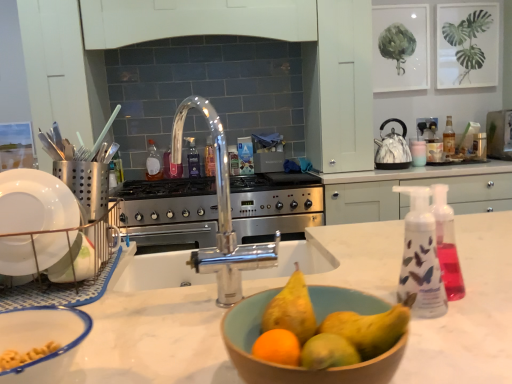
Question: Considering the positions of marble-patterned kettle at right, placed as the second kitchen appliance when sorted from front to back, and translucent plastic bottle at center, marked as the 3th bottle in a right-to-left arrangement, in the image, is marble-patterned kettle at right, placed as the second kitchen appliance when sorted from front to back, wider or thinner than translucent plastic bottle at center, marked as the 3th bottle in a right-to-left arrangement,?

Choices:
 (A) thin
 (B) wide

Answer: (B)

Question: From the image's perspective, is marble-patterned kettle at right, placed as the second kitchen appliance when sorted from front to back, located above or below translucent plastic bottle at center, marked as the 3th bottle in a right-to-left arrangement?

Choices:
 (A) below
 (B) above

Answer: (B)

Question: Which is farther from the marble-patterned kettle at right, the 2th kitchen appliance positioned from the bottom?

Choices:
 (A) white ceramic dish rack at left, which appears as the first kitchen appliance when viewed from the left
 (B) translucent plastic bottle at center, marked as the 3th bottle in a right-to-left arrangement
 (C) satin silver utensil holder at left, the first appliance in the left-to-right sequence
 (D) dark purple glass bottle at center, placed as the 2th bottle when sorted from right to left
 (E) metallic silver toaster at upper right, the second appliance ordered from the bottom

Answer: (A)

Question: Estimate the real-world distances between objects in this image. Which object is farther from the white matte cabinet at upper right?

Choices:
 (A) translucent plastic bottle at right, the third bottle viewed from the left
 (B) wooden bowl at center, which ranks as the 2th basin in left-to-right order
 (C) satin silver utensil holder at left, placed as the 2th appliance when sorted from right to left
 (D) white plastic bowl at lower left, positioned as the 1th basin in left-to-right order
 (E) dark purple glass bottle at center, placed as the 2th bottle when sorted from right to left

Answer: (D)